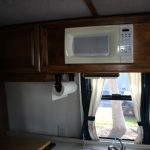
Locate an element on the screen. The height and width of the screenshot is (150, 150). paper towels is located at coordinates coord(65,86).